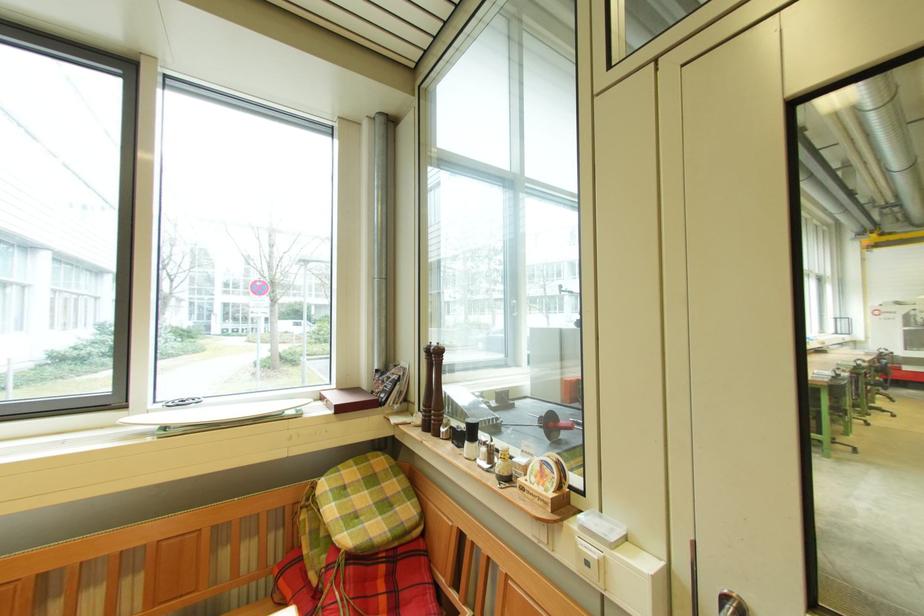
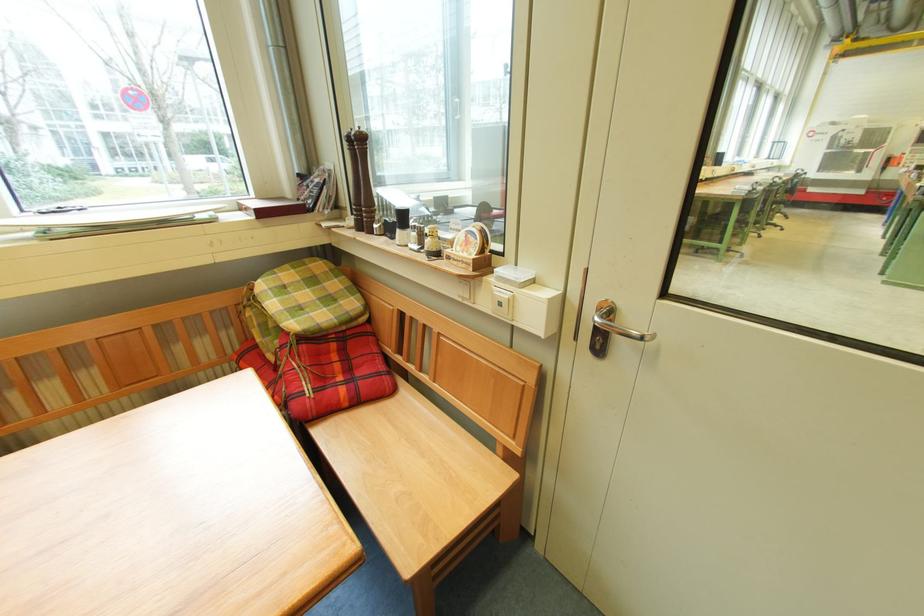
The point at (492, 453) is marked in the first image. Where is the corresponding point in the second image?

(421, 236)